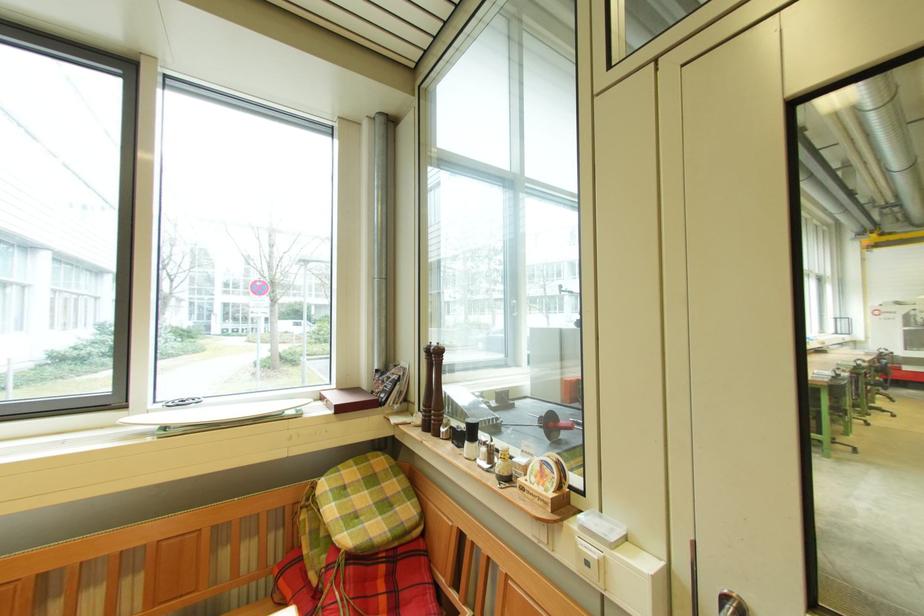
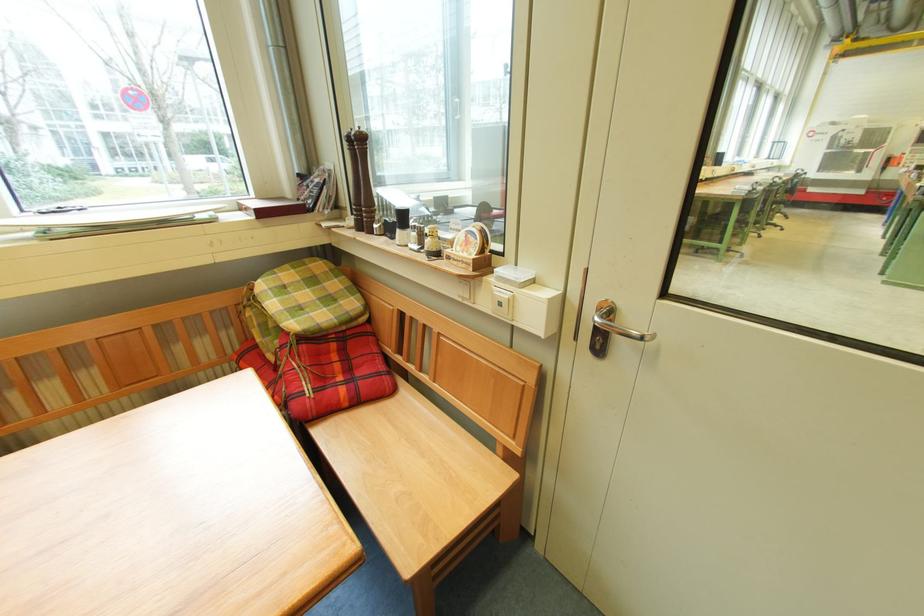
The point at (492, 453) is marked in the first image. Where is the corresponding point in the second image?

(421, 236)